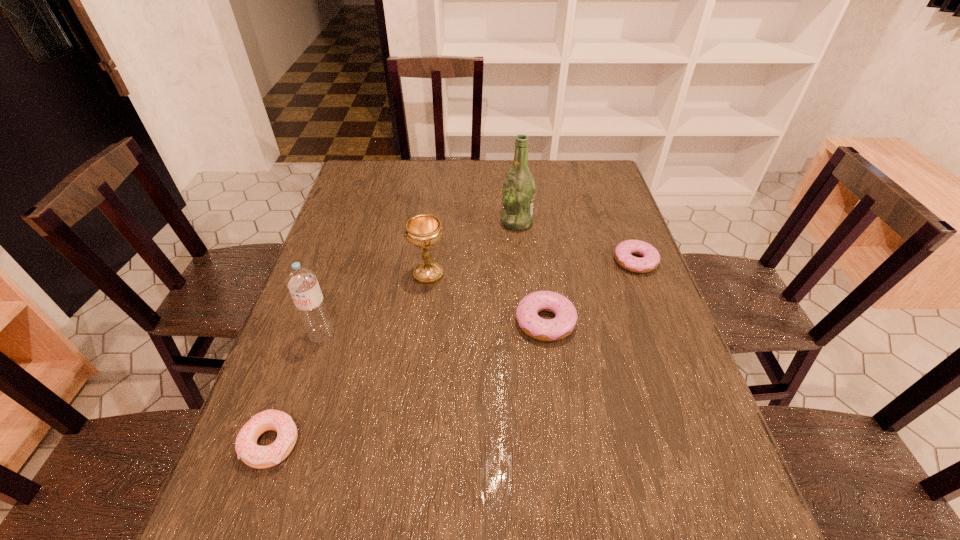
The image size is (960, 540). What are the coordinates of `vacant space situated on the left of the second farthest doughnut` in the screenshot? It's located at click(x=366, y=321).

The height and width of the screenshot is (540, 960). Identify the location of vacant area situated on the left of the shortest doughnut. click(x=475, y=261).

Locate an element on the screen. The width and height of the screenshot is (960, 540). blank space located on the right of the water bottle is located at coordinates (389, 335).

This screenshot has height=540, width=960. What are the coordinates of `blank space located 0.050m on the surface of the beer bottle` in the screenshot? It's located at (485, 222).

This screenshot has width=960, height=540. I want to click on free spot located 0.290m on the surface of the beer bottle, so click(408, 222).

You are a GUI agent. You are given a task and a screenshot of the screen. Output one action in this format:
    pyautogui.click(x=<x>, y=<y>)
    Task: Click on the vacant area situated on the surface of the beer bottle
    The height and width of the screenshot is (540, 960).
    Given the screenshot: What is the action you would take?
    pyautogui.click(x=437, y=222)

This screenshot has height=540, width=960. In order to click on free space located on the back of the chalice in this screenshot , I will do `click(439, 193)`.

This screenshot has width=960, height=540. Identify the location of free space located on the right of the leftmost doughnut. (365, 443).

In order to click on object that is positioned at the near edge in this screenshot , I will do `click(256, 456)`.

I want to click on water bottle at the left edge, so click(301, 281).